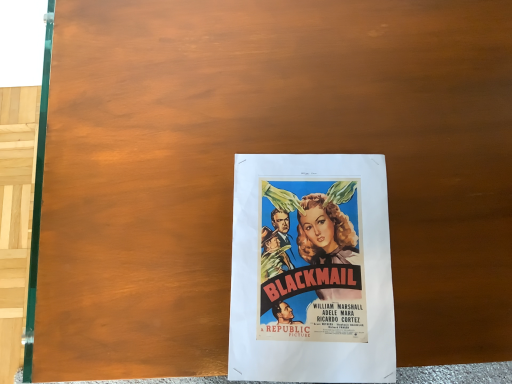
Where is `blank space above white paper poster at center (from a real-world perspective)`? The height and width of the screenshot is (384, 512). blank space above white paper poster at center (from a real-world perspective) is located at coordinates (306, 293).